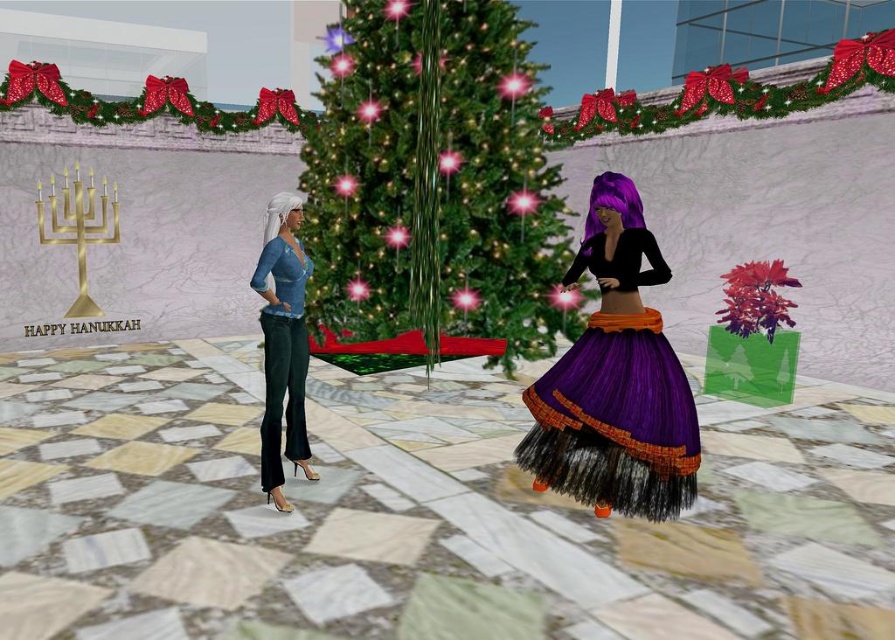
Describe the element at coordinates (615, 380) in the screenshot. I see `purple tulle skirt at center` at that location.

Locate an element on the screen. Image resolution: width=895 pixels, height=640 pixels. purple tulle skirt at center is located at coordinates (615, 380).

Can you confirm if green shiny christmas tree at center is wider than purple tulle skirt at center?

Correct, the width of green shiny christmas tree at center exceeds that of purple tulle skirt at center.

Describe the element at coordinates (497, 186) in the screenshot. I see `green shiny christmas tree at center` at that location.

Which is behind, point (499, 77) or point (602, 259)?

The point (499, 77) is more distant.

Identify the location of green shiny christmas tree at center. The height and width of the screenshot is (640, 895). (497, 186).

Is point (361, 161) behind point (301, 378)?

Yes, point (361, 161) is farther from viewer.

Who is positioned more to the right, green shiny christmas tree at center or velvet teal pants at left?

Positioned to the right is green shiny christmas tree at center.

You are a GUI agent. You are given a task and a screenshot of the screen. Output one action in this format:
    pyautogui.click(x=<x>, y=<y>)
    Task: Click on the green shiny christmas tree at center
    The width and height of the screenshot is (895, 640).
    Given the screenshot: What is the action you would take?
    pyautogui.click(x=497, y=186)